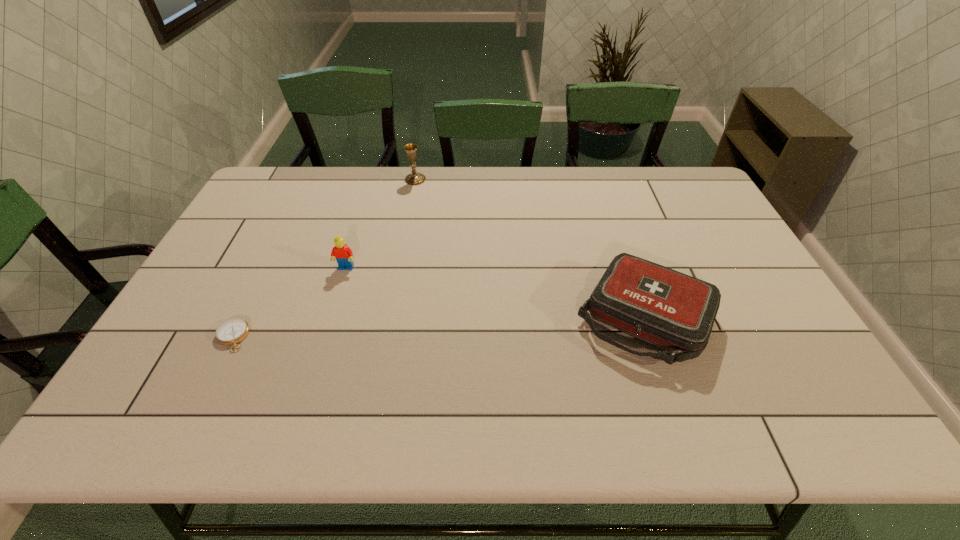
The image size is (960, 540). Find the location of `vacant area that lies between the rightmost object and the Lego`. vacant area that lies between the rightmost object and the Lego is located at coordinates (495, 293).

Image resolution: width=960 pixels, height=540 pixels. What are the coordinates of `vacant space that is in between the compass and the second object from right to left` in the screenshot? It's located at click(x=324, y=258).

You are a GUI agent. You are given a task and a screenshot of the screen. Output one action in this format:
    pyautogui.click(x=<x>, y=<y>)
    Task: Click on the vacant area that lies between the first-aid kit and the farthest object
    The image size is (960, 540).
    Given the screenshot: What is the action you would take?
    pyautogui.click(x=530, y=249)

The height and width of the screenshot is (540, 960). I want to click on free space between the rightmost object and the chalice, so click(x=530, y=249).

This screenshot has height=540, width=960. I want to click on empty location between the shortest object and the farthest object, so click(x=324, y=258).

Where is `free spot between the Lego and the chalice`? The height and width of the screenshot is (540, 960). free spot between the Lego and the chalice is located at coordinates [380, 224].

Identify the location of free area in between the compass and the first-aid kit. This screenshot has width=960, height=540. (439, 327).

At what (x,y) coordinates should I click in order to perform the action: click on free spot between the second object from left to right and the rightmost object. Please return your answer as a coordinate pair (x, y). Looking at the image, I should click on point(495,293).

Locate an element on the screen. This screenshot has height=540, width=960. free area in between the first-aid kit and the chalice is located at coordinates (530, 249).

Find the location of a particular element. The width and height of the screenshot is (960, 540). object that is the third nearest to the shortest object is located at coordinates (668, 309).